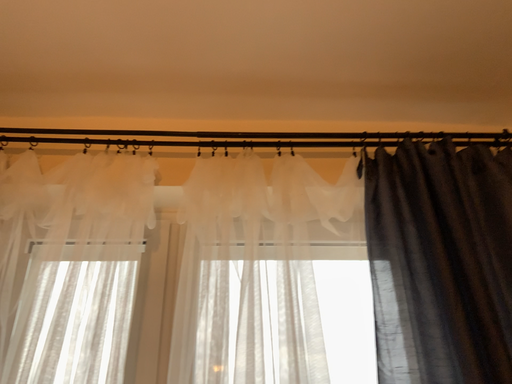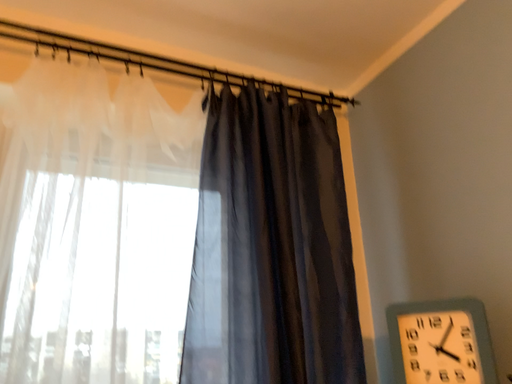
Question: How did the camera likely rotate when shooting the video?

Choices:
 (A) rotated left
 (B) rotated right

Answer: (B)